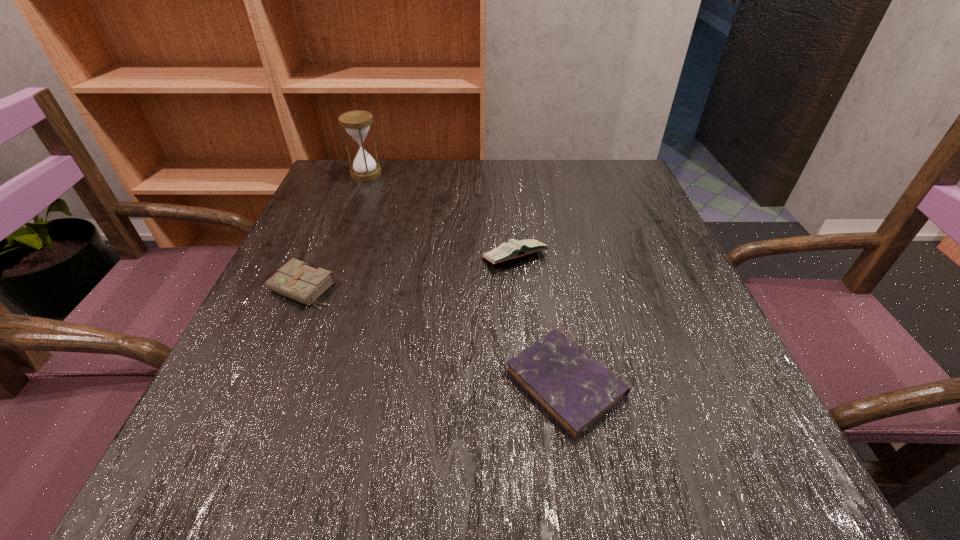
Where is `vacant region located 0.390m on the left of the shortest object`? This screenshot has height=540, width=960. vacant region located 0.390m on the left of the shortest object is located at coordinates (246, 382).

This screenshot has height=540, width=960. Find the location of `object located at the far edge`. object located at the far edge is located at coordinates (357, 123).

Find the location of a particular element. object situated at the near edge is located at coordinates (575, 389).

Find the location of a particular element. The height and width of the screenshot is (540, 960). hourglass positioned at the left edge is located at coordinates (357, 123).

This screenshot has width=960, height=540. Identify the location of diary positioned at the left edge. (295, 280).

Locate an element on the screen. object that is at the far left corner is located at coordinates (357, 123).

In the image, there is a desktop. Identify the location of vacant space at the far edge. This screenshot has width=960, height=540. (470, 164).

Locate an element on the screen. The height and width of the screenshot is (540, 960). blank area at the near edge is located at coordinates (359, 495).

This screenshot has width=960, height=540. I want to click on free spot at the left edge of the desktop, so click(275, 305).

I want to click on free space at the right edge, so click(730, 370).